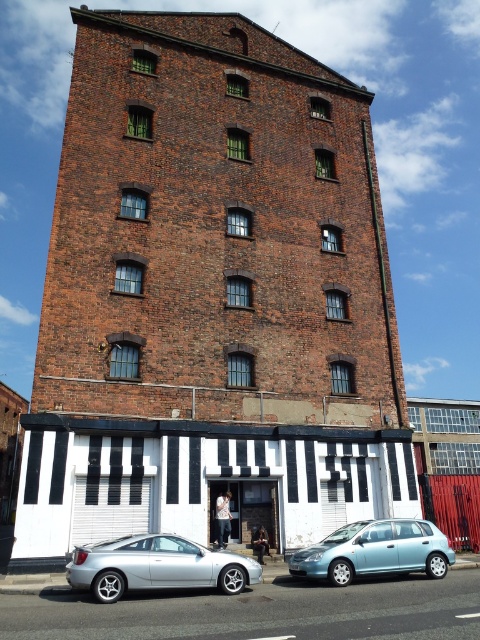
You are standing at the entrance of the building and want to park your car. The parking spot is at point 0.886, 0.327. Is the silver metallic car at lower left currently occupying that spot?

The silver metallic car at lower left is located at point (156,566), so yes, it is occupying the parking spot at that coordinate.

You are a delivery person trying to park your van between the silver metallic car at lower left and the light blue metallic hatchback at lower right. Since your van is 1.8 meters tall, will you be able to fit through the space between them?

The silver metallic car at lower left is much taller than the light blue metallic hatchback at lower right. Since the van is 1.8 meters tall, it may not fit if the space between the cars is constrained by the height of the taller silver metallic car at lower left. However, the description does not provide specific measurements for the height of the space between the cars, so it is uncertain.